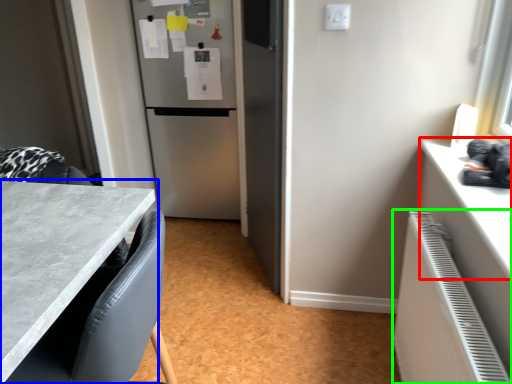
Question: Estimate the real-world distances between objects in this image. Which object is closer to counter top (highlighted by a red box), countertop (highlighted by a blue box) or radiator (highlighted by a green box)?

Choices:
 (A) countertop
 (B) radiator

Answer: (B)